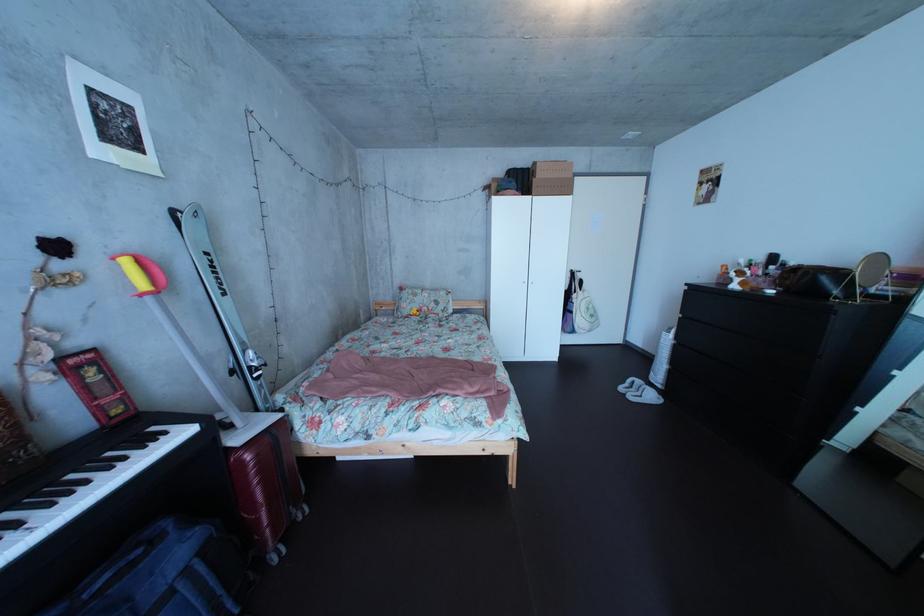
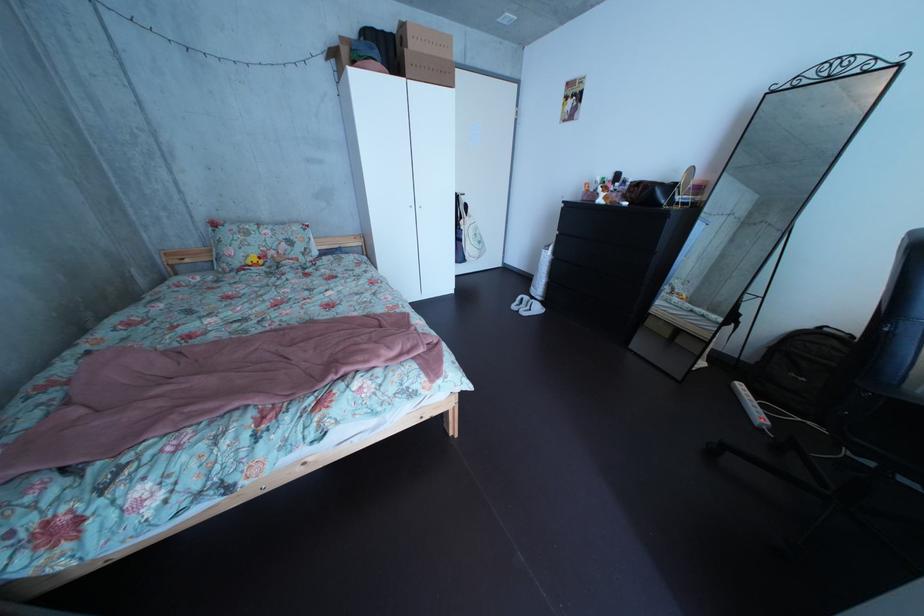
Locate, in the second image, the point that corresponds to the point at 550,172 in the first image.

(418, 34)